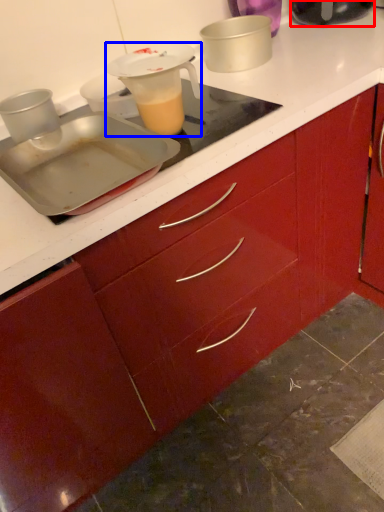
Question: Which object appears closest to the camera in this image, kitchen appliance (highlighted by a red box) or jug (highlighted by a blue box)?

Choices:
 (A) kitchen appliance
 (B) jug

Answer: (B)